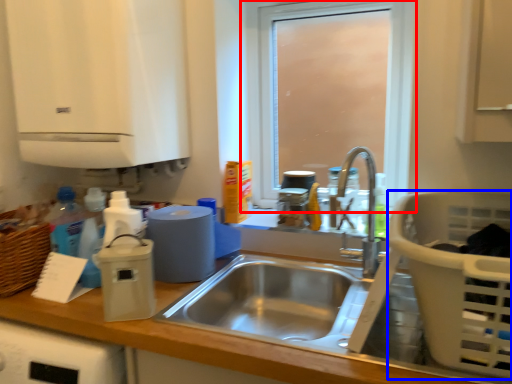
Question: Among these objects, which one is farthest to the camera, window (highlighted by a red box) or basket (highlighted by a blue box)?

Choices:
 (A) window
 (B) basket

Answer: (A)